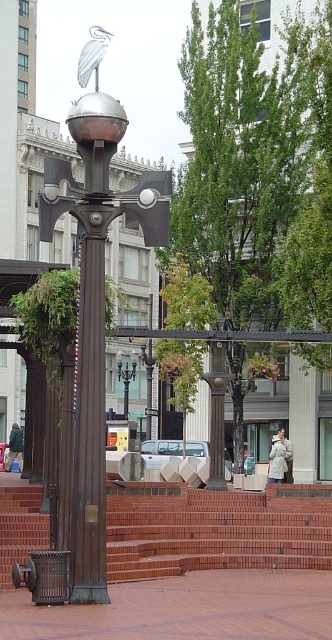
Does brick stairs at center have a larger size compared to bronze textured column at center?

Indeed, brick stairs at center has a larger size compared to bronze textured column at center.

Locate an element on the screen. The width and height of the screenshot is (332, 640). brick stairs at center is located at coordinates point(215,529).

Which of these two, brick stairs at center or polished bronze streetlight at center, stands taller?

polished bronze streetlight at center

Which is above, brick stairs at center or polished bronze streetlight at center?

polished bronze streetlight at center is higher up.

The image size is (332, 640). What do you see at coordinates (215, 529) in the screenshot?
I see `brick stairs at center` at bounding box center [215, 529].

In order to click on brick stairs at center in this screenshot , I will do `click(215, 529)`.

Who is positioned more to the left, bronze textured column at center or polished bronze streetlight at center?

polished bronze streetlight at center is more to the left.

What do you see at coordinates (217, 413) in the screenshot? The image size is (332, 640). I see `bronze textured column at center` at bounding box center [217, 413].

Who is more distant from viewer, (217, 458) or (118, 378)?

Point (118, 378)

Identify the location of bronze textured column at center. (217, 413).